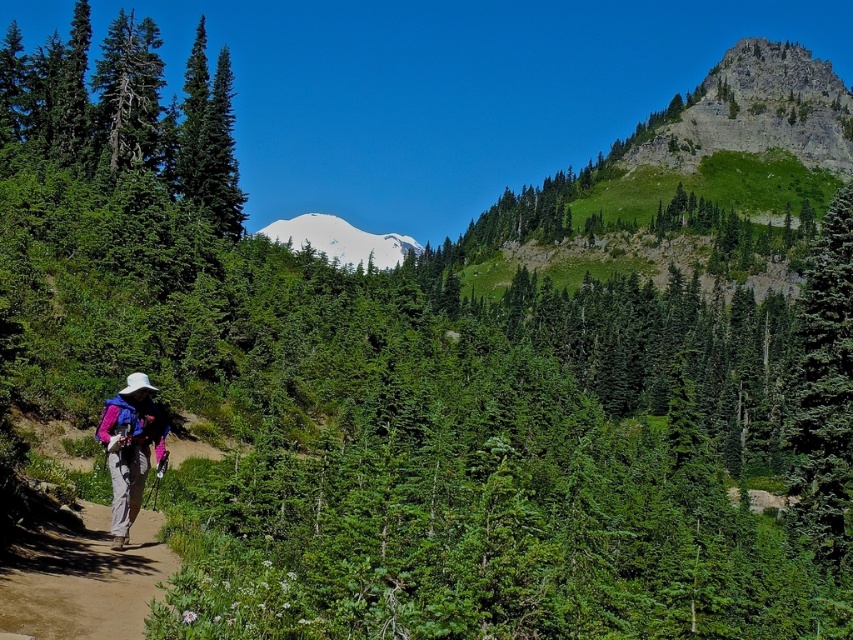
Question: Where is brown dirt path at lower left located in relation to white snow-covered mountain at center in the image?

Choices:
 (A) left
 (B) right

Answer: (B)

Question: Which of these objects is positioned closest to the pink fabric backpack at lower left?

Choices:
 (A) brown dirt path at lower left
 (B) white snow-covered mountain at center
 (C) green textured tree at right

Answer: (A)

Question: Does green textured tree at right lie in front of pink fabric backpack at lower left?

Choices:
 (A) no
 (B) yes

Answer: (A)

Question: Which object is the closest to the green textured tree at right?

Choices:
 (A) white snow-covered mountain at center
 (B) pink fabric backpack at lower left
 (C) brown dirt path at lower left

Answer: (B)

Question: Does green textured tree at right have a smaller size compared to brown dirt path at lower left?

Choices:
 (A) no
 (B) yes

Answer: (A)

Question: Which of the following is the closest to the observer?

Choices:
 (A) brown dirt path at lower left
 (B) green textured tree at right
 (C) pink fabric backpack at lower left

Answer: (A)